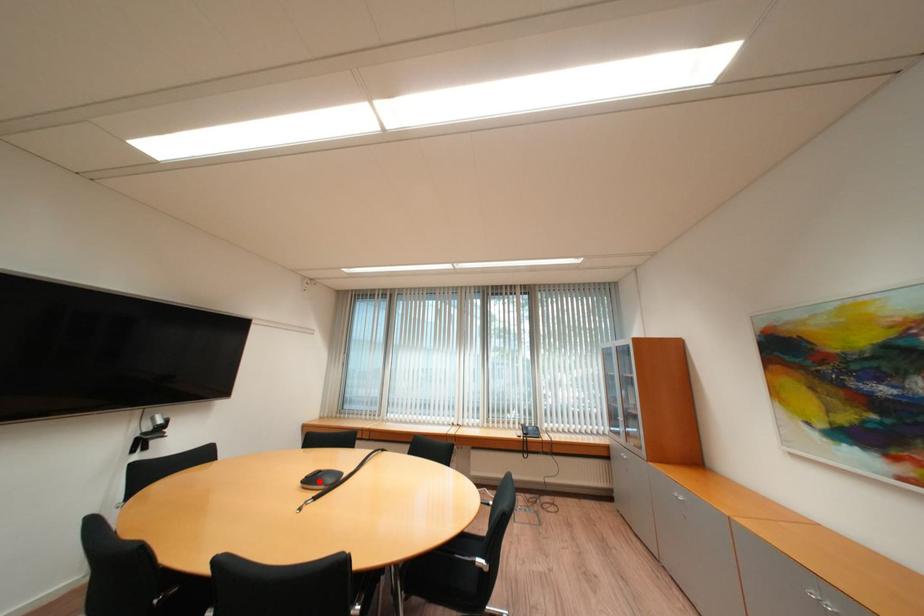
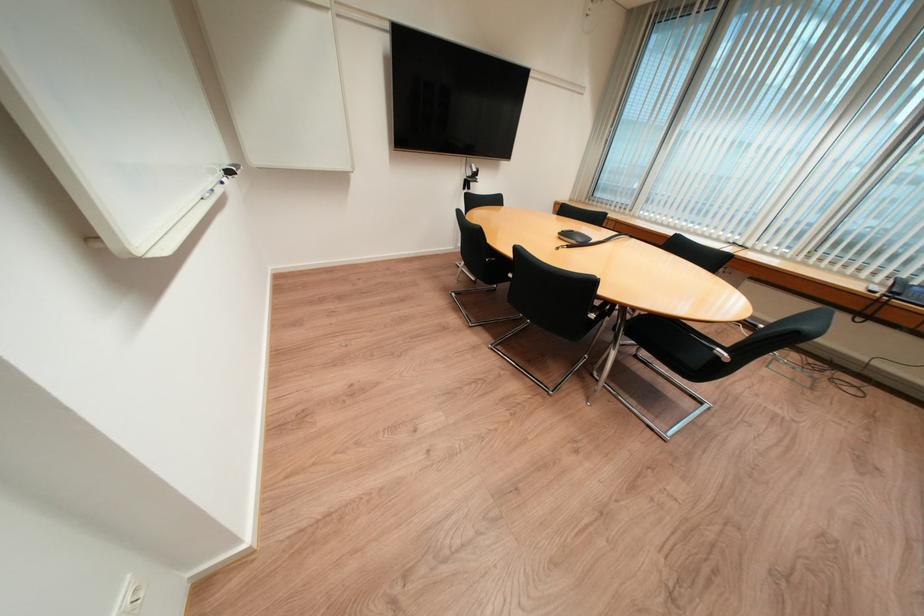
Locate, in the second image, the point that corresponds to the highlighted location in the first image.

(574, 236)